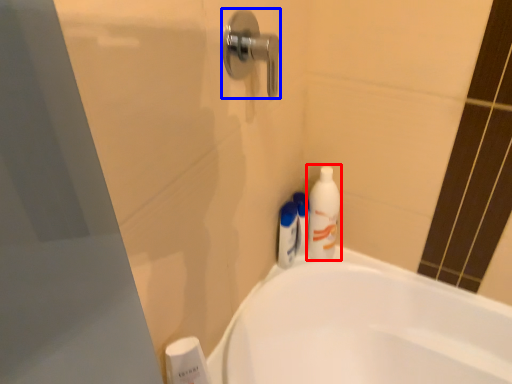
Question: Among these objects, which one is nearest to the camera, cleaning product (highlighted by a red box) or door handle (highlighted by a blue box)?

Choices:
 (A) cleaning product
 (B) door handle

Answer: (B)